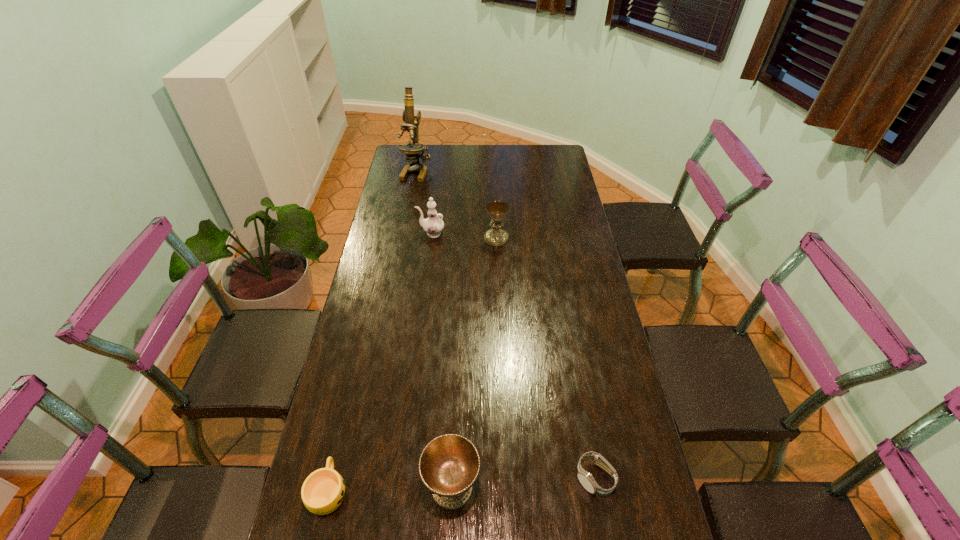
Locate an element on the screen. This screenshot has height=540, width=960. free space located 0.170m at the spout of the chinaware is located at coordinates (375, 233).

Where is `vacant region located 0.130m at the spout of the chinaware`? The width and height of the screenshot is (960, 540). vacant region located 0.130m at the spout of the chinaware is located at coordinates (385, 233).

Identify the location of vacant space located 0.130m at the spout of the chinaware. (385, 233).

This screenshot has height=540, width=960. What are the coordinates of `vacant space located 0.170m on the back of the farther chalice` in the screenshot? It's located at (495, 205).

I want to click on vacant space positioned on the right of the nearer chalice, so click(616, 487).

The width and height of the screenshot is (960, 540). I want to click on vacant area situated on the face of the watch, so click(x=603, y=525).

Locate an element on the screen. vacant space located on the right of the cup is located at coordinates (390, 490).

Image resolution: width=960 pixels, height=540 pixels. In order to click on object that is at the far edge in this screenshot , I will do `click(412, 150)`.

In order to click on microscope that is at the left edge in this screenshot , I will do `click(412, 150)`.

Where is `cup that is at the left edge`? cup that is at the left edge is located at coordinates pyautogui.click(x=323, y=491).